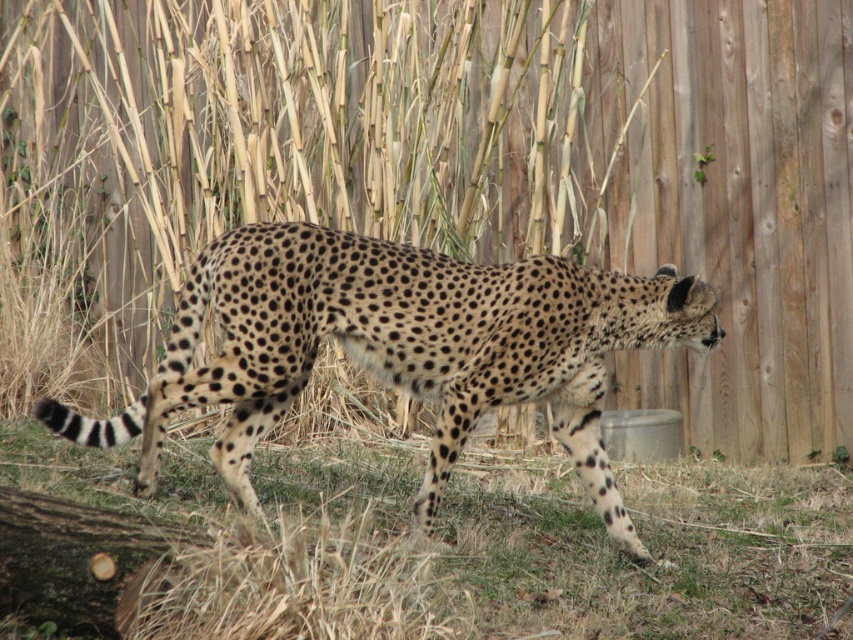
Does point (12, 236) lie behind point (309, 522)?

Yes, it is behind point (309, 522).

Find the location of `wooden fence at center`. wooden fence at center is located at coordinates (468, 163).

This screenshot has width=853, height=640. Identify the location of wooden fence at center. (x=468, y=163).

Who is more forward, (767, 104) or (270, 426)?

Point (270, 426) is more forward.

Does point (334, 156) come behind point (581, 428)?

Yes, it is behind point (581, 428).

Which is in front, point (129, 10) or point (579, 436)?

Point (579, 436)

Image resolution: width=853 pixels, height=640 pixels. Identify the location of wooden fence at center. (468, 163).

Who is more forward, (787,474) or (445,259)?

Positioned in front is point (445,259).

Who is more distant from viewer, (785, 506) or (619, 348)?

The point (785, 506) is more distant.

Which is behind, point (785, 636) or point (430, 502)?

The point (430, 502) is more distant.

At what (x,y) coordinates should I click in order to perform the action: click on green grass at lower center. Please return your answer as a coordinate pair (x, y). The image size is (853, 640). Looking at the image, I should click on (474, 545).